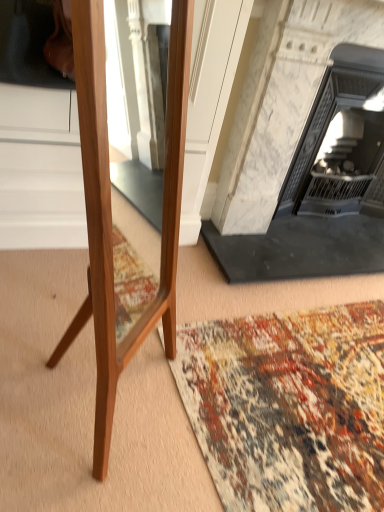
The image size is (384, 512). What do you see at coordinates (331, 112) in the screenshot?
I see `white marble fireplace at upper right, the 2th fireplace viewed from the left` at bounding box center [331, 112].

This screenshot has width=384, height=512. I want to click on multicolored woven rug at lower center, so (289, 407).

How different are the orientations of white marble fireplace at upper right, the 2th fireplace viewed from the left, and multicolored woven rug at lower center in degrees?

white marble fireplace at upper right, the 2th fireplace viewed from the left, and multicolored woven rug at lower center are facing 0.705 degrees away from each other.

Measure the distance from white marble fireplace at upper right, placed as the 1th fireplace when sorted from right to left, to multicolored woven rug at lower center.

They are 3.76 feet apart.

From a real-world perspective, which is physically above, white marble fireplace at upper right, the 2th fireplace viewed from the left, or multicolored woven rug at lower center?

In real-world perspective, white marble fireplace at upper right, the 2th fireplace viewed from the left, is above.

The width and height of the screenshot is (384, 512). Find the location of `fireplace that is the 1st one above the multicolored woven rug at lower center (from a real-world perspective)`. fireplace that is the 1st one above the multicolored woven rug at lower center (from a real-world perspective) is located at coordinates (331, 112).

Is white marble fireplace at center, arranged as the 1th fireplace when viewed from the left, taller or shorter than multicolored woven rug at lower center?

white marble fireplace at center, arranged as the 1th fireplace when viewed from the left, is taller than multicolored woven rug at lower center.

Consider the image. Which object is thinner, white marble fireplace at center, the 2th fireplace in the right-to-left sequence, or multicolored woven rug at lower center?

With smaller width is white marble fireplace at center, the 2th fireplace in the right-to-left sequence.

From a real-world perspective, is white marble fireplace at center, the 2th fireplace in the right-to-left sequence, under multicolored woven rug at lower center?

No, from a real-world perspective, white marble fireplace at center, the 2th fireplace in the right-to-left sequence, is not under multicolored woven rug at lower center.

Which object is positioned more to the left, white marble fireplace at center, arranged as the 1th fireplace when viewed from the left, or multicolored woven rug at lower center?

multicolored woven rug at lower center.

At what (x,y) coordinates should I click in order to perform the action: click on fireplace beneath the white marble fireplace at center, the 2th fireplace in the right-to-left sequence (from a real-world perspective). Please return your answer as a coordinate pair (x, y). Looking at the image, I should click on (331, 112).

From a real-world perspective, is white marble fireplace at upper right, the 2th fireplace viewed from the left, positioned above or below white marble fireplace at center, arranged as the 1th fireplace when viewed from the left?

Clearly, from a real-world perspective, white marble fireplace at upper right, the 2th fireplace viewed from the left, is below white marble fireplace at center, arranged as the 1th fireplace when viewed from the left.

In terms of height, does white marble fireplace at upper right, the 2th fireplace viewed from the left, look taller or shorter compared to white marble fireplace at center, arranged as the 1th fireplace when viewed from the left?

white marble fireplace at upper right, the 2th fireplace viewed from the left, is shorter than white marble fireplace at center, arranged as the 1th fireplace when viewed from the left.

How many degrees apart are the facing directions of white marble fireplace at upper right, the 2th fireplace viewed from the left, and white marble fireplace at center, the 2th fireplace in the right-to-left sequence?

There is a 0.000881-degree angle between the facing directions of white marble fireplace at upper right, the 2th fireplace viewed from the left, and white marble fireplace at center, the 2th fireplace in the right-to-left sequence.

Is multicolored woven rug at lower center at the left side of white marble fireplace at center, the 2th fireplace in the right-to-left sequence?

Indeed, multicolored woven rug at lower center is positioned on the left side of white marble fireplace at center, the 2th fireplace in the right-to-left sequence.

Measure the distance from multicolored woven rug at lower center to white marble fireplace at center, arranged as the 1th fireplace when viewed from the left.

The distance of multicolored woven rug at lower center from white marble fireplace at center, arranged as the 1th fireplace when viewed from the left, is 25.98 inches.

Does point (285, 344) come closer to viewer compared to point (365, 263)?

That is True.

In the scene shown: From a real-world perspective, is white marble fireplace at center, arranged as the 1th fireplace when viewed from the left, physically above white marble fireplace at upper right, placed as the 1th fireplace when sorted from right to left?

Yes, from a real-world perspective, white marble fireplace at center, arranged as the 1th fireplace when viewed from the left, is on top of white marble fireplace at upper right, placed as the 1th fireplace when sorted from right to left.

Are white marble fireplace at center, arranged as the 1th fireplace when viewed from the left, and white marble fireplace at upper right, the 2th fireplace viewed from the left, located far from each other?

Actually, white marble fireplace at center, arranged as the 1th fireplace when viewed from the left, and white marble fireplace at upper right, the 2th fireplace viewed from the left, are a little close together.

How far apart are white marble fireplace at center, arranged as the 1th fireplace when viewed from the left, and white marble fireplace at upper right, the 2th fireplace viewed from the left?

white marble fireplace at center, arranged as the 1th fireplace when viewed from the left, is 6.61 inches from white marble fireplace at upper right, the 2th fireplace viewed from the left.

Is white marble fireplace at center, the 2th fireplace in the right-to-left sequence, taller or shorter than white marble fireplace at upper right, placed as the 1th fireplace when sorted from right to left?

In the image, white marble fireplace at center, the 2th fireplace in the right-to-left sequence, appears to be taller than white marble fireplace at upper right, placed as the 1th fireplace when sorted from right to left.

Is white marble fireplace at upper right, the 2th fireplace viewed from the left, located within multicolored woven rug at lower center?

No, white marble fireplace at upper right, the 2th fireplace viewed from the left, is not inside multicolored woven rug at lower center.

Does multicolored woven rug at lower center turn towards white marble fireplace at upper right, placed as the 1th fireplace when sorted from right to left?

No, multicolored woven rug at lower center is not oriented towards white marble fireplace at upper right, placed as the 1th fireplace when sorted from right to left.

Which object is further away from the camera taking this photo, multicolored woven rug at lower center or white marble fireplace at upper right, placed as the 1th fireplace when sorted from right to left?

white marble fireplace at upper right, placed as the 1th fireplace when sorted from right to left, is further from the camera.

Is multicolored woven rug at lower center in contact with white marble fireplace at upper right, placed as the 1th fireplace when sorted from right to left?

No, multicolored woven rug at lower center is not next to white marble fireplace at upper right, placed as the 1th fireplace when sorted from right to left.

Identify the location of the 1st fireplace positioned above the multicolored woven rug at lower center (from the image's perspective). The image size is (384, 512). (331, 112).

The image size is (384, 512). Identify the location of mat on the left side of white marble fireplace at center, arranged as the 1th fireplace when viewed from the left. (289, 407).

Estimate the real-world distances between objects in this image. Which object is closer to white marble fireplace at upper right, the 2th fireplace viewed from the left, white marble fireplace at center, arranged as the 1th fireplace when viewed from the left, or multicolored woven rug at lower center?

white marble fireplace at center, arranged as the 1th fireplace when viewed from the left, is positioned closer to the anchor white marble fireplace at upper right, the 2th fireplace viewed from the left.

Looking at the image, which one is located further to white marble fireplace at center, the 2th fireplace in the right-to-left sequence, white marble fireplace at upper right, placed as the 1th fireplace when sorted from right to left, or multicolored woven rug at lower center?

Among the two, multicolored woven rug at lower center is located further to white marble fireplace at center, the 2th fireplace in the right-to-left sequence.

Which object lies nearer to the anchor point white marble fireplace at upper right, the 2th fireplace viewed from the left, multicolored woven rug at lower center or white marble fireplace at center, arranged as the 1th fireplace when viewed from the left?

Among the two, white marble fireplace at center, arranged as the 1th fireplace when viewed from the left, is located nearer to white marble fireplace at upper right, the 2th fireplace viewed from the left.

Based on their spatial positions, is multicolored woven rug at lower center or white marble fireplace at upper right, the 2th fireplace viewed from the left, further from white marble fireplace at center, arranged as the 1th fireplace when viewed from the left?

multicolored woven rug at lower center.

Estimate the real-world distances between objects in this image. Which object is closer to multicolored woven rug at lower center, white marble fireplace at upper right, the 2th fireplace viewed from the left, or white marble fireplace at center, arranged as the 1th fireplace when viewed from the left?

white marble fireplace at center, arranged as the 1th fireplace when viewed from the left, is closer to multicolored woven rug at lower center.

Based on their spatial positions, is white marble fireplace at center, arranged as the 1th fireplace when viewed from the left, or white marble fireplace at upper right, the 2th fireplace viewed from the left, further from multicolored woven rug at lower center?

white marble fireplace at upper right, the 2th fireplace viewed from the left, is further to multicolored woven rug at lower center.

You are a GUI agent. You are given a task and a screenshot of the screen. Output one action in this format:
    pyautogui.click(x=<x>, y=<y>)
    Task: Click on the fireplace between white marble fireplace at center, the 2th fireplace in the right-to-left sequence, and multicolored woven rug at lower center from top to bottom
    The height and width of the screenshot is (512, 384).
    Given the screenshot: What is the action you would take?
    tap(331, 112)